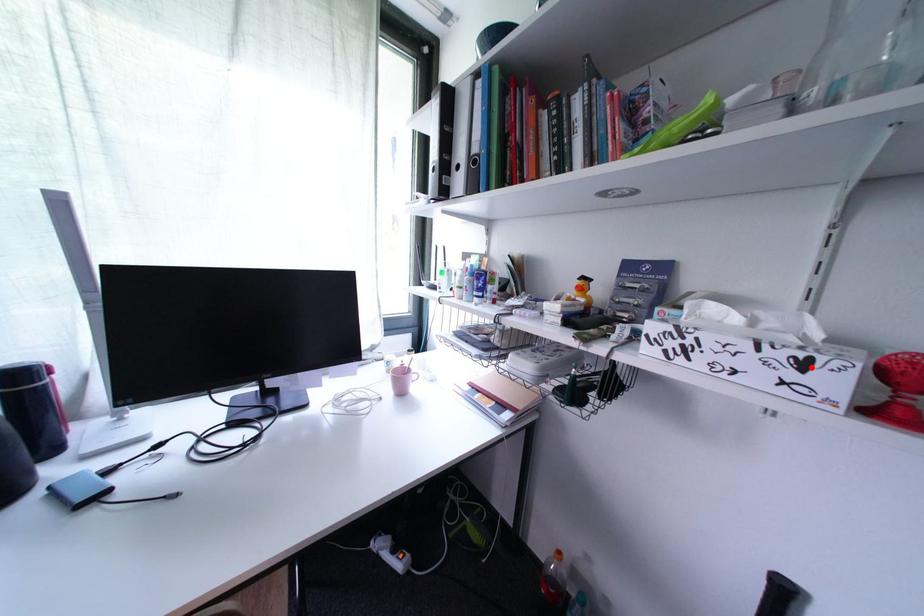
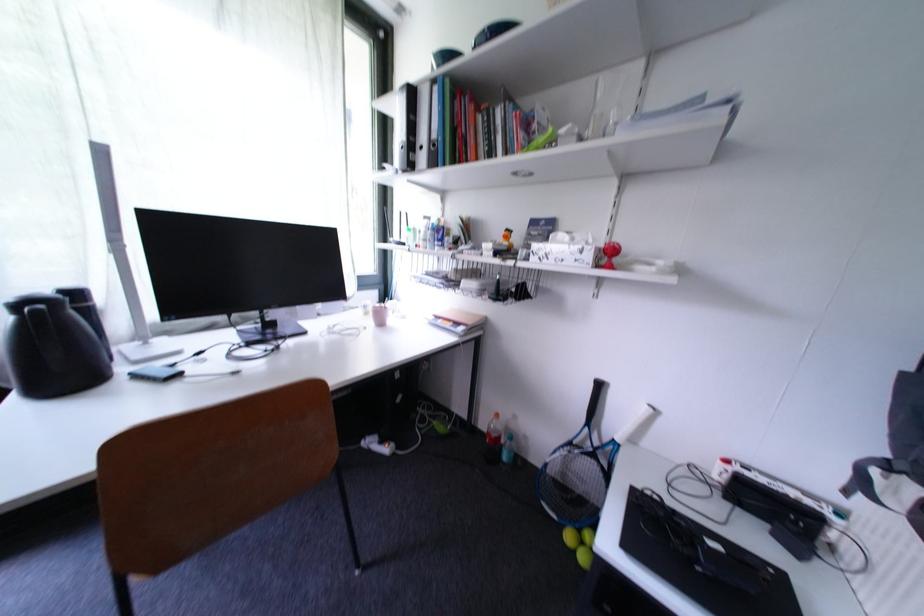
The point at the highlighted location is marked in the first image. Where is the corresponding point in the second image?

(590, 253)